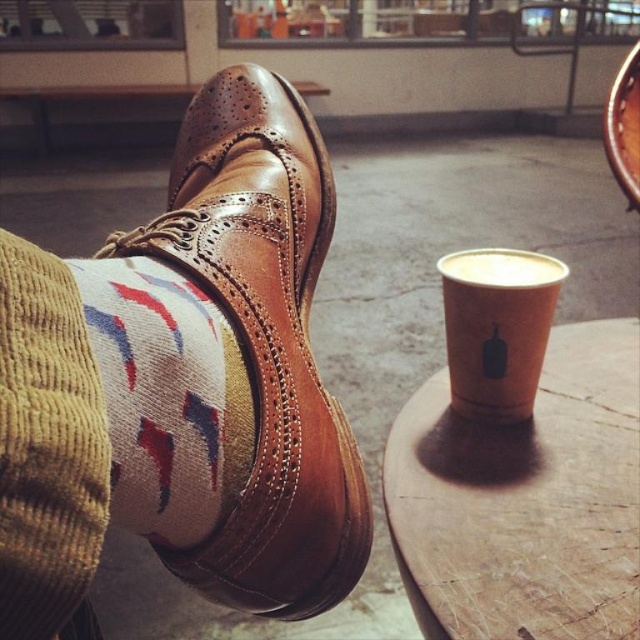
You are a barista trying to deliver a drink to a customer. You see the wooden table at center and the white matte cup at center. Which object is closer to you?

The wooden table at center is closer to you because it is in front of the white matte cup at center.

You are taking a photo of the scene and want to focus on both the point at coordinates point (120, 259) and the point at coordinates point (456, 264). Which point should you focus on first to ensure both are in sharp focus?

You should focus on point (120, 259) first because it is closer to the camera than point (456, 264), ensuring both points will be in focus when using a proper depth of field.